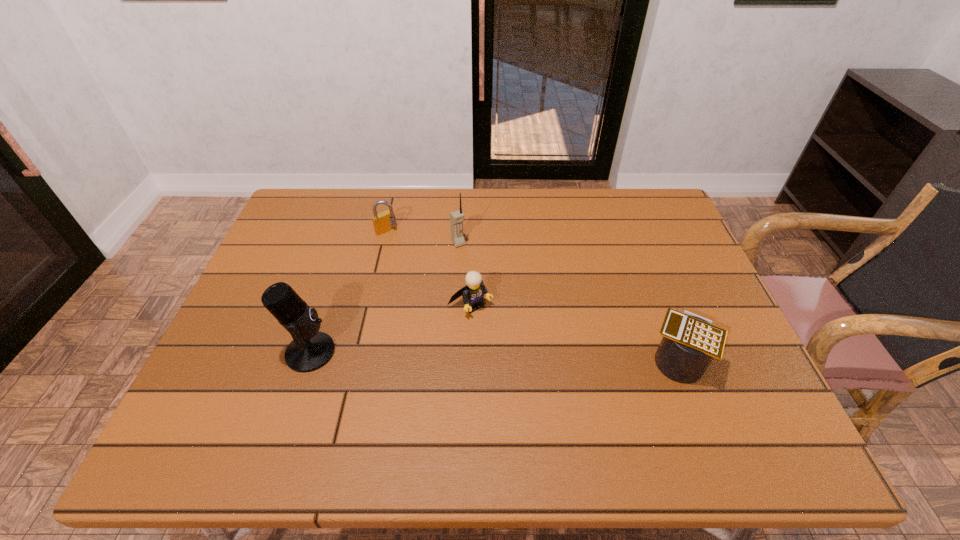
Find the location of a particular element. This screenshot has width=960, height=540. free point located on the side with the combination dials of the padlock is located at coordinates 426,266.

Where is `vacant space located 0.320m on the side with the combination dials of the padlock`? Image resolution: width=960 pixels, height=540 pixels. vacant space located 0.320m on the side with the combination dials of the padlock is located at coordinates (456, 293).

Where is `free space located on the side with the combination dials of the padlock`? free space located on the side with the combination dials of the padlock is located at coordinates (434, 273).

The height and width of the screenshot is (540, 960). What are the coordinates of `free space located on the front of the fourth nearest object, where the keypad is located` in the screenshot? It's located at (511, 318).

At what (x,y) coordinates should I click in order to perform the action: click on vacant space located on the front of the fourth nearest object, where the keypad is located. Please return your answer as a coordinate pair (x, y). This screenshot has width=960, height=540. Looking at the image, I should click on (515, 323).

The width and height of the screenshot is (960, 540). I want to click on vacant region located on the front of the fourth nearest object, where the keypad is located, so coord(478,271).

Locate an element on the screen. The height and width of the screenshot is (540, 960). vacant space located on the front-facing side of the third farthest object is located at coordinates (519, 354).

This screenshot has width=960, height=540. In order to click on vacant space located on the front-facing side of the third farthest object in this screenshot , I will do `click(528, 362)`.

Identify the location of free location located 0.250m on the front-facing side of the third farthest object. (552, 387).

Find the location of a particular element. object located at the far edge is located at coordinates (383, 222).